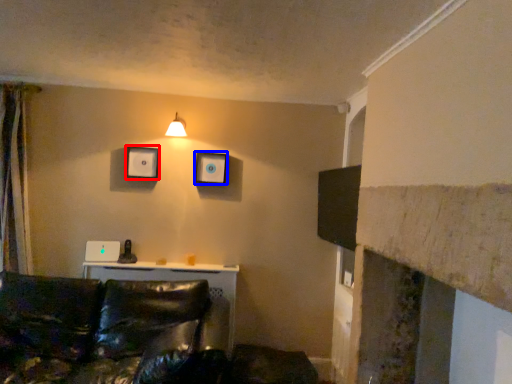
Question: Which object appears closest to the camera in this image, picture frame (highlighted by a red box) or picture frame (highlighted by a blue box)?

Choices:
 (A) picture frame
 (B) picture frame

Answer: (A)